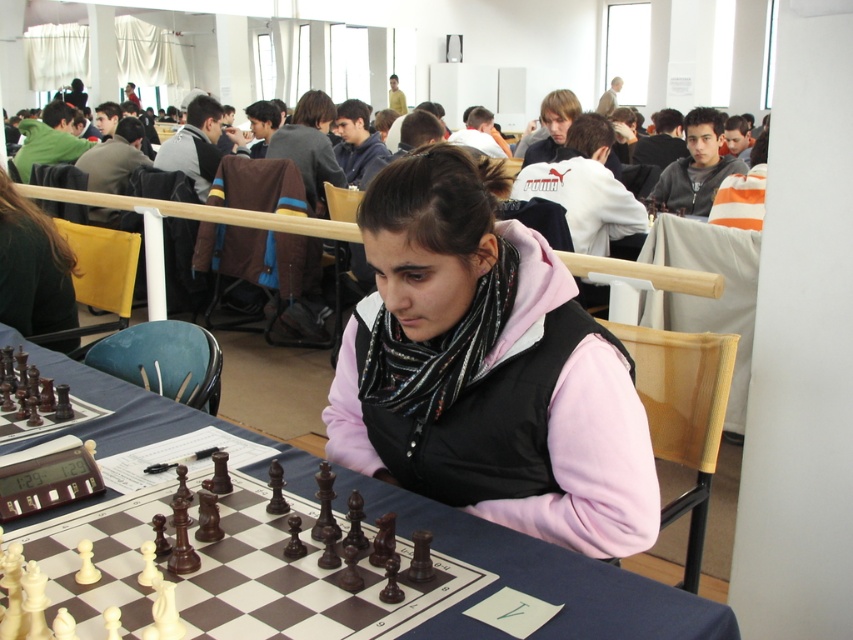
Question: Which object is closer to the camera taking this photo?

Choices:
 (A) pink fleece vest at center
 (B) wooden chessboard at center
 (C) wooden chess set at center

Answer: (B)

Question: Is wooden chess set at center thinner than wooden chessboard at center?

Choices:
 (A) yes
 (B) no

Answer: (A)

Question: Can you confirm if pink fleece vest at center is wider than black fabric scarf at upper left?

Choices:
 (A) no
 (B) yes

Answer: (B)

Question: Which of the following is the closest to the observer?

Choices:
 (A) pink fleece vest at center
 (B) wooden chess set at center
 (C) wooden chessboard at center

Answer: (C)

Question: Which point is farther from the camera taking this photo?

Choices:
 (A) (492, 472)
 (B) (563, 627)

Answer: (A)

Question: Can you confirm if wooden chessboard at center is wider than black fabric scarf at upper left?

Choices:
 (A) yes
 (B) no

Answer: (A)